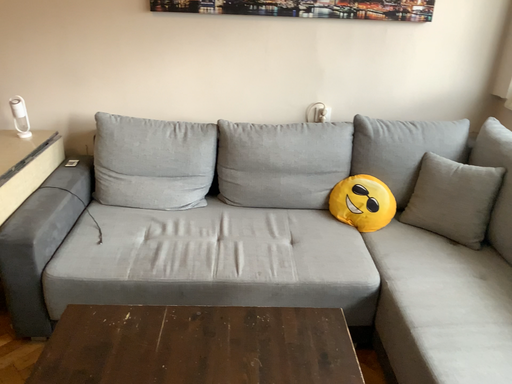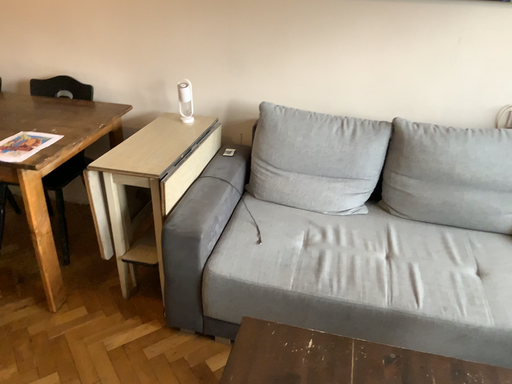
Question: How did the camera likely rotate when shooting the video?

Choices:
 (A) rotated left
 (B) rotated right

Answer: (A)